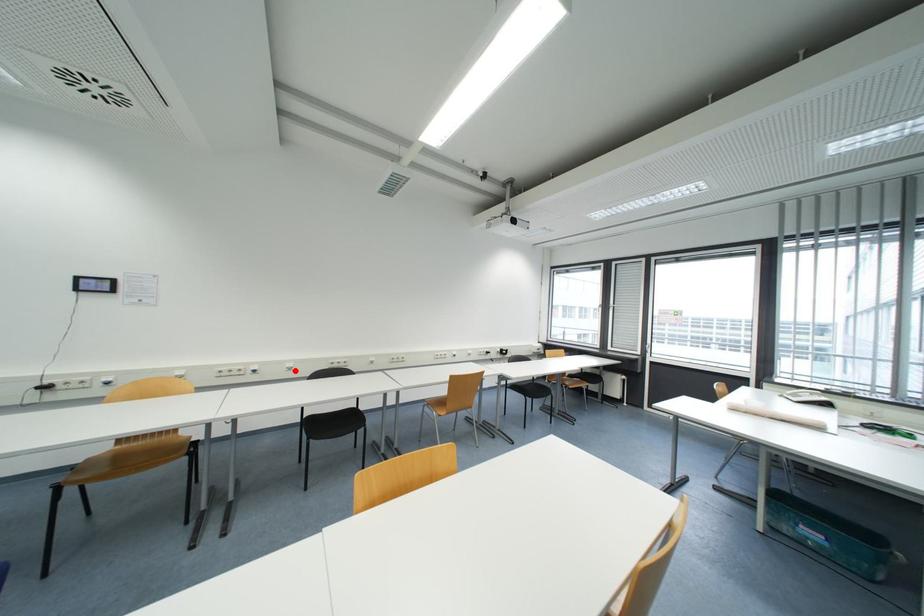
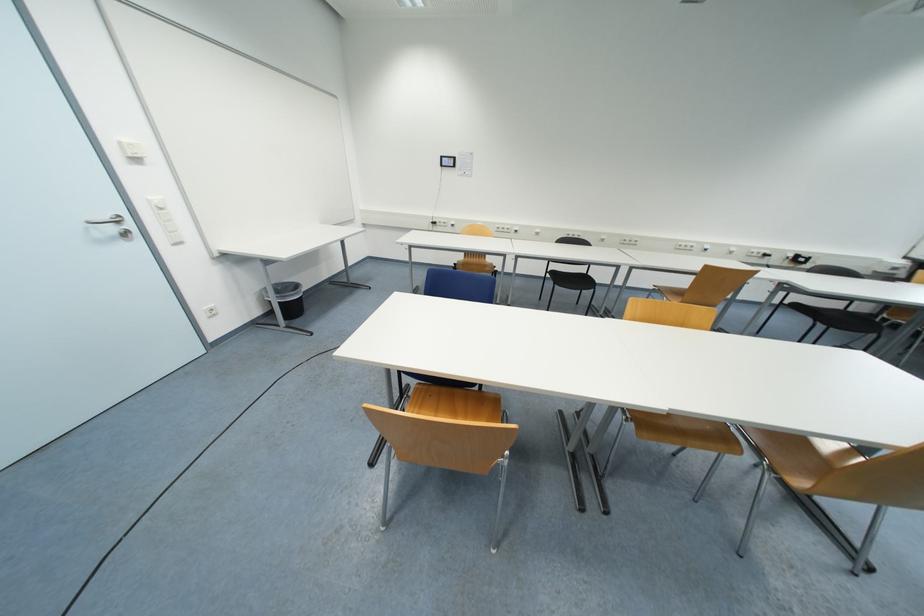
Locate, in the second image, the point that corresponds to the highlighted location in the first image.

(541, 236)